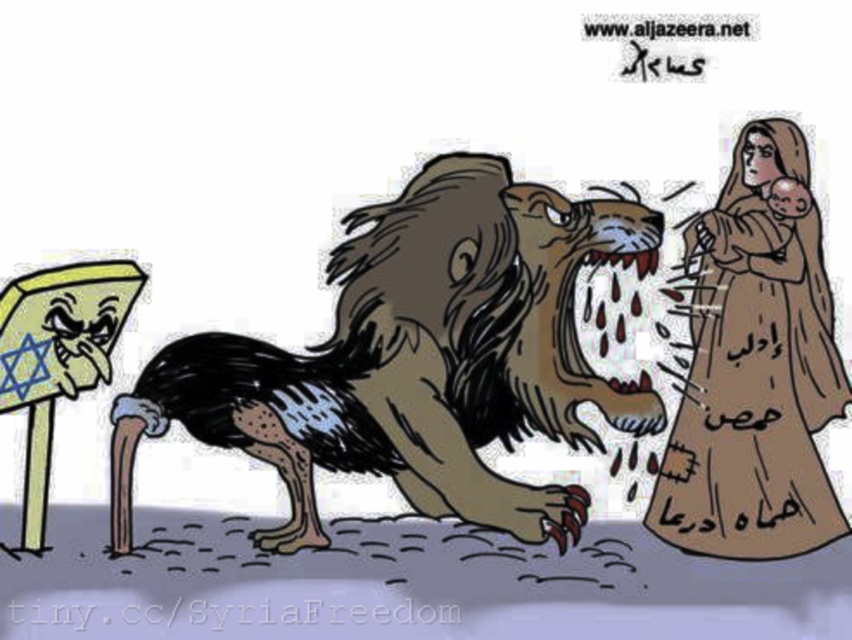
Can you confirm if brown furry lion at center is bigger than brown fabric person at right?

Yes.

Who is positioned more to the left, brown furry lion at center or brown fabric person at right?

brown furry lion at center is more to the left.

The width and height of the screenshot is (852, 640). Find the location of `brown furry lion at center`. brown furry lion at center is located at coordinates (416, 358).

At what (x,y) coordinates should I click in order to perform the action: click on brown furry lion at center. Please return your answer as a coordinate pair (x, y). Image resolution: width=852 pixels, height=640 pixels. Looking at the image, I should click on (416, 358).

Who is higher up, brown fabric person at right or yellow paper sign at left?

Positioned higher is brown fabric person at right.

Who is shorter, brown fabric person at right or yellow paper sign at left?

Standing shorter between the two is yellow paper sign at left.

What are the coordinates of `brown fabric person at right` in the screenshot? It's located at (755, 365).

Locate an element on the screen. The image size is (852, 640). brown fabric person at right is located at coordinates (755, 365).

Is point (367, 456) farther from viewer compared to point (45, 282)?

That is True.

The height and width of the screenshot is (640, 852). I want to click on brown furry lion at center, so click(416, 358).

The height and width of the screenshot is (640, 852). I want to click on brown furry lion at center, so click(x=416, y=358).